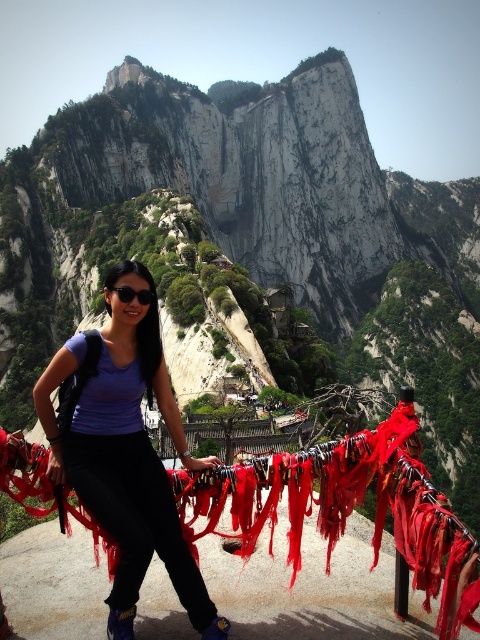
Question: Does smooth white rock at center have a larger size compared to red fabric ribbon at center?

Choices:
 (A) yes
 (B) no

Answer: (A)

Question: Which object appears farthest from the camera in this image?

Choices:
 (A) matte black sunglasses at center
 (B) matte purple shirt at center
 (C) red fabric ribbon at center
 (D) smooth white rock at center

Answer: (D)

Question: Considering the real-world distances, which object is farthest from the matte purple shirt at center?

Choices:
 (A) matte black sunglasses at center
 (B) smooth white rock at center
 (C) red fabric ribbon at center

Answer: (B)

Question: From the image, what is the correct spatial relationship of smooth white rock at center in relation to matte black sunglasses at center?

Choices:
 (A) left
 (B) right

Answer: (B)

Question: Which object appears farthest from the camera in this image?

Choices:
 (A) red fabric ribbon at center
 (B) matte purple shirt at center
 (C) smooth white rock at center

Answer: (C)

Question: Can you confirm if smooth white rock at center is positioned above matte black sunglasses at center?

Choices:
 (A) yes
 (B) no

Answer: (A)